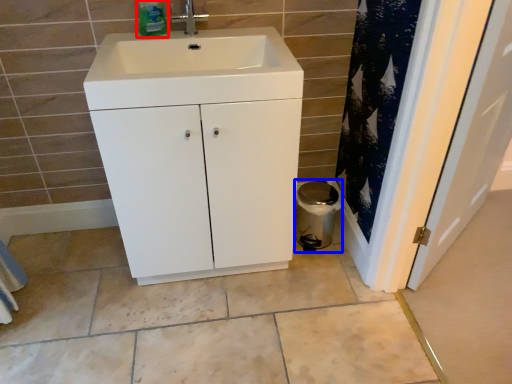
Question: Which point is further to the camera, bottle (highlighted by a red box) or appliance (highlighted by a blue box)?

Choices:
 (A) bottle
 (B) appliance

Answer: (B)